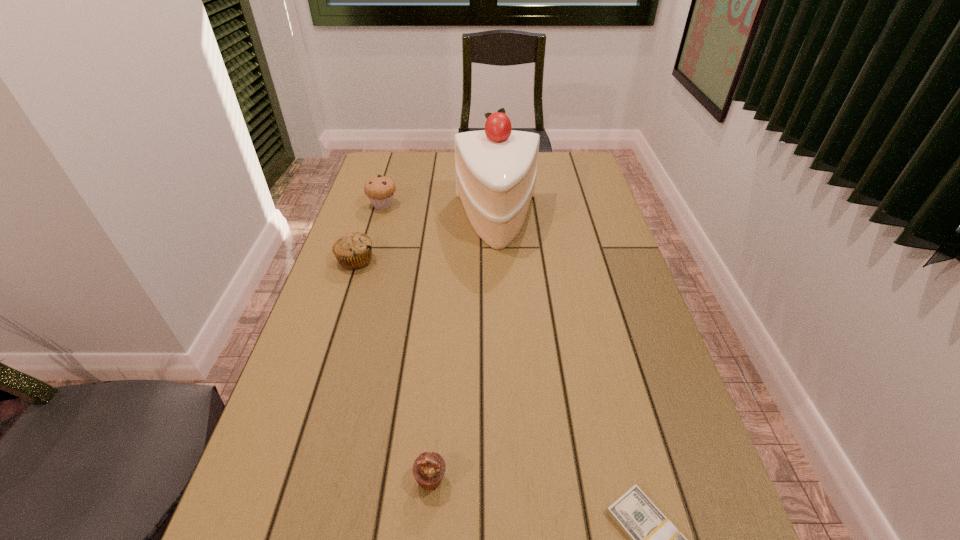
You are a GUI agent. You are given a task and a screenshot of the screen. Output one action in this format:
    pyautogui.click(x=<x>, y=<y>)
    Task: Click on the free spot at the right edge of the desktop
    The image size is (960, 540).
    Given the screenshot: What is the action you would take?
    pyautogui.click(x=584, y=244)

Where is `free spot at the far right corner of the desktop`? free spot at the far right corner of the desktop is located at coordinates (562, 159).

Locate an element on the screen. This screenshot has width=960, height=540. vacant area that lies between the farthest muffin and the cake is located at coordinates (440, 213).

Locate an element on the screen. Image resolution: width=960 pixels, height=540 pixels. vacant space in between the second farthest muffin and the farthest muffin is located at coordinates (370, 233).

This screenshot has height=540, width=960. Identify the location of free space between the nearest muffin and the second nearest muffin. (394, 370).

In order to click on free space between the second farthest muffin and the nearest muffin in this screenshot , I will do `click(394, 370)`.

This screenshot has width=960, height=540. I want to click on free space between the nearest muffin and the second nearest muffin, so click(x=394, y=370).

Where is `free space between the nearest muffin and the second nearest muffin`? free space between the nearest muffin and the second nearest muffin is located at coordinates (394, 370).

This screenshot has width=960, height=540. Identify the location of empty location between the second farthest muffin and the farthest muffin. (370, 233).

Find the location of `object that is the fourth closest one to the rightmost object`. object that is the fourth closest one to the rightmost object is located at coordinates (380, 190).